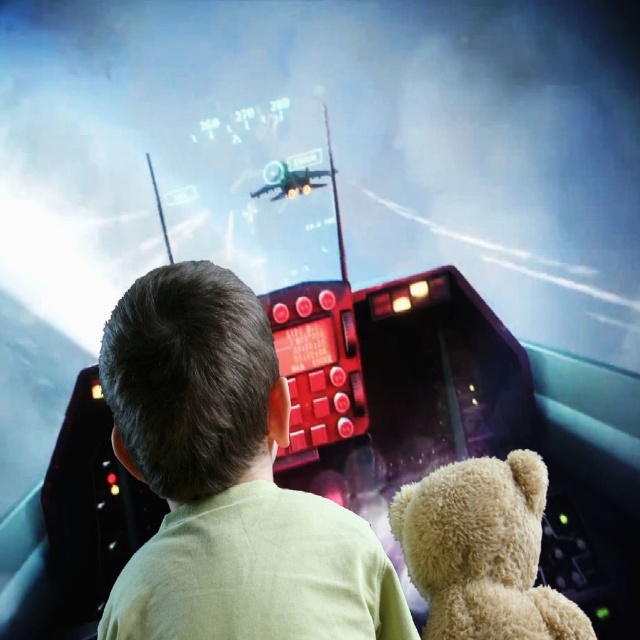
You are a pilot preparing for takeoff in the cockpit. You notice the fuzzy beige teddy bear at center and the shiny black plane at center. Which object is larger in size?

The fuzzy beige teddy bear at center is bigger than the shiny black plane at center.

You are designing a storage compartment for the cockpit that must fit both the shiny black helmet at center and the fuzzy beige teddy bear at center. Based on their sizes, which object requires more horizontal space in the compartment?

The shiny black helmet at center requires more horizontal space because its width surpasses that of the fuzzy beige teddy bear at center.